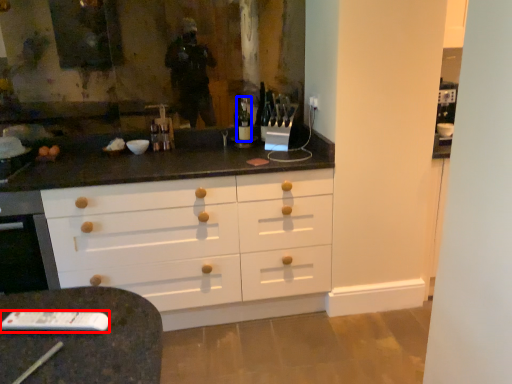
Question: Which of the following is the farthest to the observer, remote (highlighted by a red box) or bottle (highlighted by a blue box)?

Choices:
 (A) remote
 (B) bottle

Answer: (B)